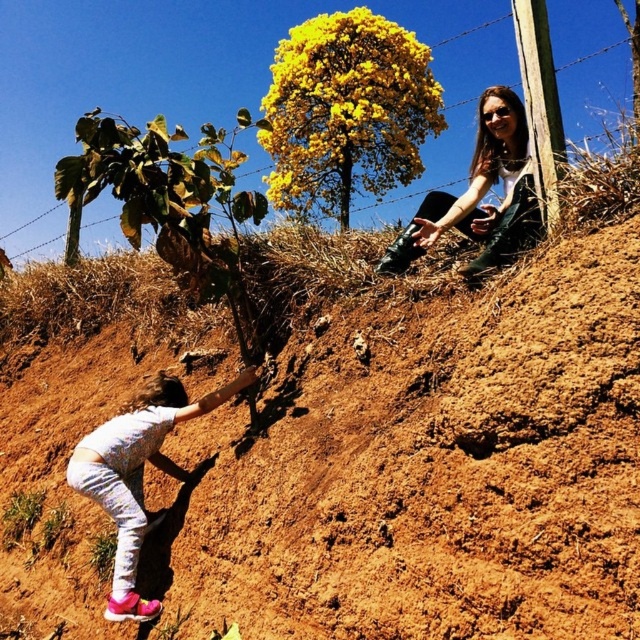
Who is positioned more to the right, brown dirt at lower right or matte black boots at upper right?

matte black boots at upper right

Between point (1, 416) and point (534, 192), which one is positioned in front?

Point (534, 192) is in front.

Where is `brown dirt at lower right`? This screenshot has width=640, height=640. brown dirt at lower right is located at coordinates (426, 467).

Which of these two, white cotton pants at lower left or matte black boots at upper right, stands shorter?

With less height is matte black boots at upper right.

Looking at this image, is white cotton pants at lower left further to the viewer compared to matte black boots at upper right?

Yes, white cotton pants at lower left is further from the viewer.

This screenshot has height=640, width=640. What do you see at coordinates (138, 474) in the screenshot?
I see `white cotton pants at lower left` at bounding box center [138, 474].

The width and height of the screenshot is (640, 640). I want to click on white cotton pants at lower left, so click(138, 474).

This screenshot has width=640, height=640. I want to click on yellow leafy tree at upper center, so click(346, 112).

Is yellow leafy tree at upper center to the left of white cotton pants at lower left from the viewer's perspective?

In fact, yellow leafy tree at upper center is to the right of white cotton pants at lower left.

Where is `yellow leafy tree at upper center`? The width and height of the screenshot is (640, 640). yellow leafy tree at upper center is located at coordinates (346, 112).